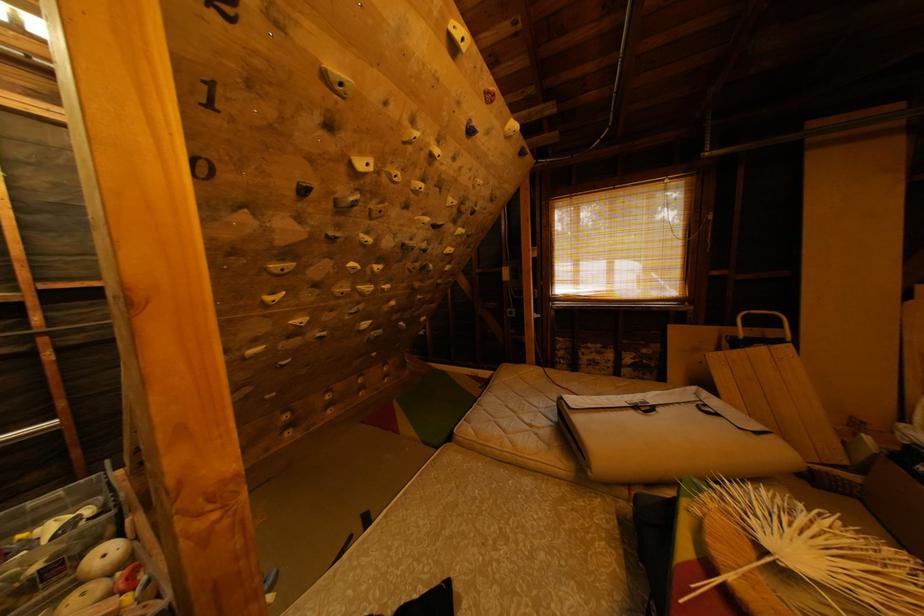
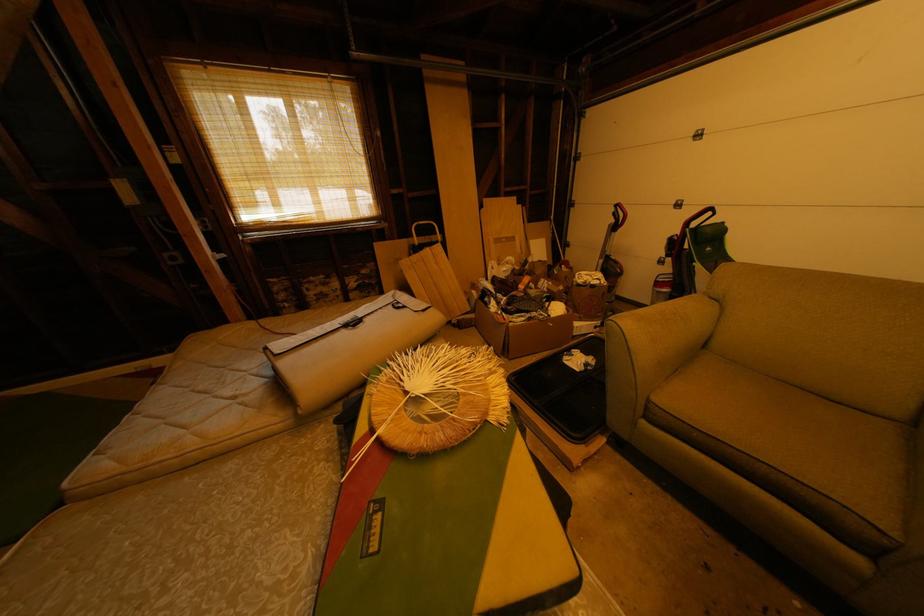
The first image is from the beginning of the video and the second image is from the end. How did the camera likely rotate when shooting the video?

The camera rotated toward right-down.